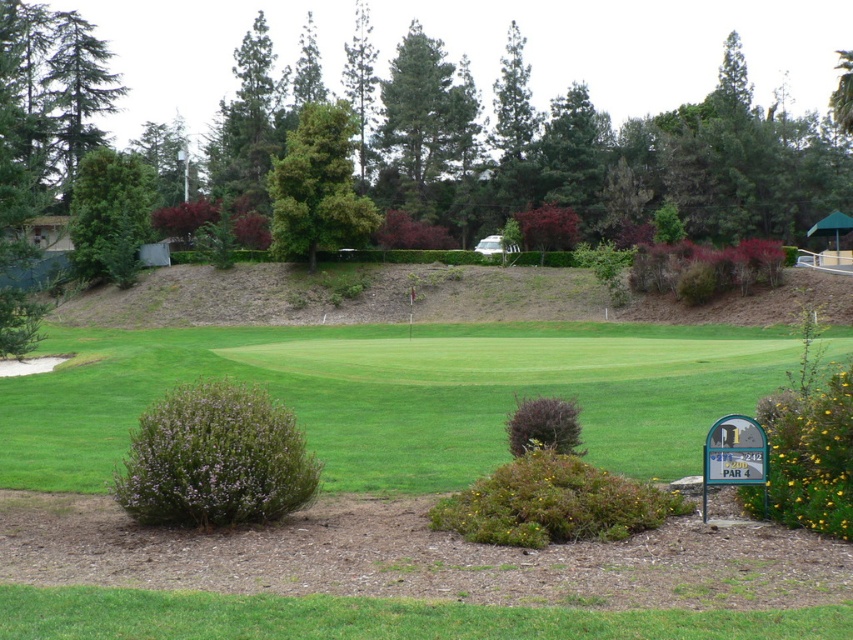
Question: Is the position of green leafy tree at center less distant than that of green leafy tree at upper right?

Choices:
 (A) no
 (B) yes

Answer: (A)

Question: Which of the following is the closest to the observer?

Choices:
 (A) [x=286, y=244]
 (B) [x=141, y=500]
 (C) [x=490, y=458]

Answer: (B)

Question: Which point is closer to the camera taking this photo?

Choices:
 (A) (306, 148)
 (B) (79, 228)
 (C) (560, 444)
 (D) (791, 390)

Answer: (C)

Question: Does green grassy field at center come in front of green textured tree at upper center?

Choices:
 (A) no
 (B) yes

Answer: (B)

Question: Which point is farther from the camera taking this photo?

Choices:
 (A) (840, 518)
 (B) (845, 116)

Answer: (B)

Question: Does yellow-green leafy bush at lower right come behind green needle-like at upper left?

Choices:
 (A) no
 (B) yes

Answer: (A)